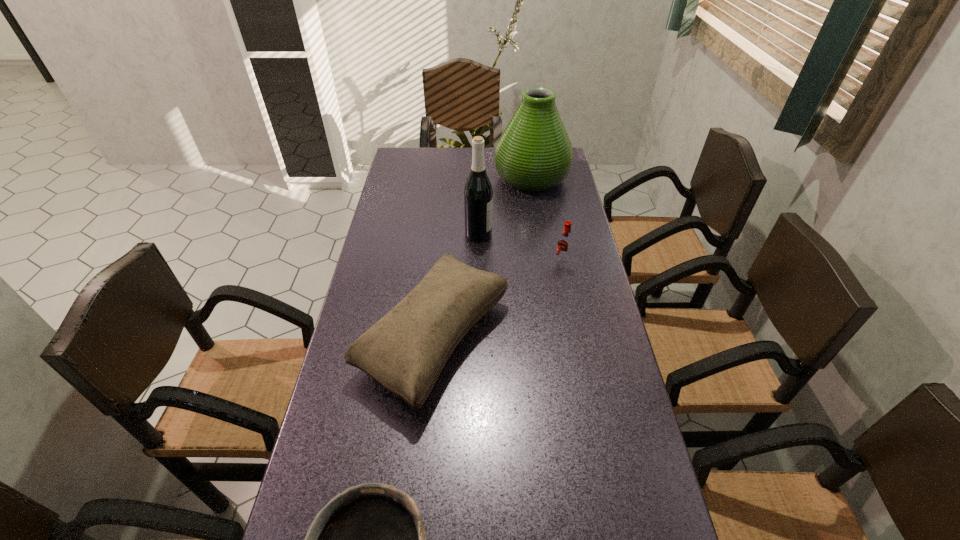
In order to click on vase at the right edge in this screenshot , I will do `click(534, 153)`.

Identify the location of root beer located in the right edge section of the desktop. [x=564, y=245].

Find the location of `object located at the far right corner`. object located at the far right corner is located at coordinates (534, 153).

What are the coordinates of `vacant space at the far edge of the desktop` in the screenshot? It's located at [x=469, y=171].

Find the location of a particular element. Image resolution: width=960 pixels, height=540 pixels. vacant space at the left edge of the desktop is located at coordinates (319, 456).

This screenshot has height=540, width=960. What are the coordinates of `vacant area at the right edge` in the screenshot? It's located at (573, 413).

Find the location of a particular element. The image size is (960, 540). free point between the wine bottle and the third nearest object is located at coordinates (520, 248).

Image resolution: width=960 pixels, height=540 pixels. What are the coordinates of `vacant area between the third nearest object and the wine bottle` in the screenshot? It's located at (520, 248).

Locate an element on the screen. The width and height of the screenshot is (960, 540). object that can be found as the second closest to the cushion is located at coordinates (564, 245).

Select which object is the third closest to the fourth nearest object. Please provide its 2D coordinates. Your answer should be formatted as a tuple, i.e. [(x, y)], where the tuple contains the x and y coordinates of a point satisfying the conditions above.

[(564, 245)]